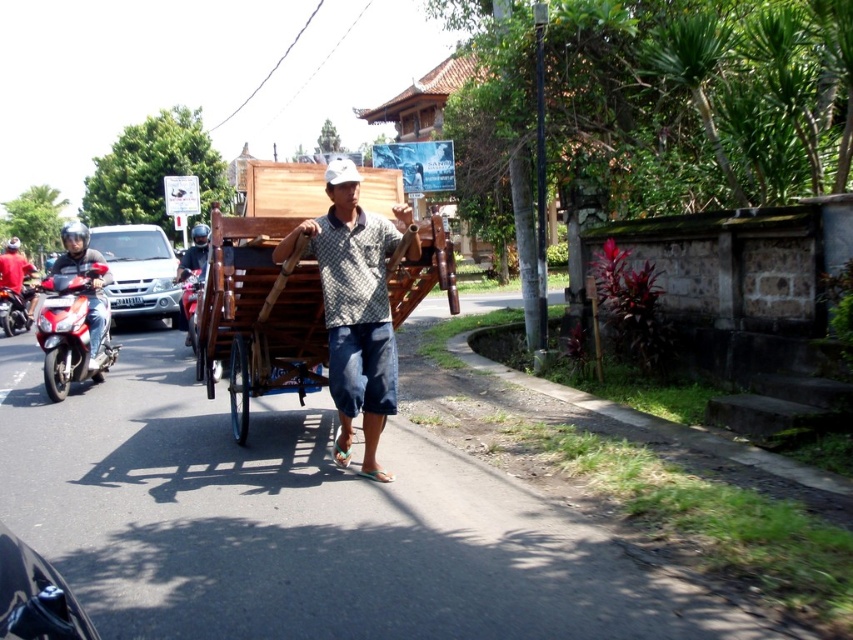
Is printed cotton shirt at center above matte black helmet at left?

Incorrect, printed cotton shirt at center is not positioned above matte black helmet at left.

Is printed cotton shirt at center further to the viewer compared to matte black helmet at left?

No, it is not.

Is point (373, 298) more distant than point (201, 228)?

That is False.

You are a GUI agent. You are given a task and a screenshot of the screen. Output one action in this format:
    pyautogui.click(x=<x>, y=<y>)
    Task: Click on the printed cotton shirt at center
    Image resolution: width=853 pixels, height=640 pixels.
    Given the screenshot: What is the action you would take?
    pyautogui.click(x=357, y=307)

Does silver metallic car at left have a smaller size compared to matte black motorcycle at left?

No.

Is silver metallic car at left taller than matte black motorcycle at left?

Correct, silver metallic car at left is much taller as matte black motorcycle at left.

Does point (113, 246) come in front of point (18, 248)?

Yes, it is in front of point (18, 248).

At what (x,y) coordinates should I click in order to perform the action: click on silver metallic car at left. Please return your answer as a coordinate pair (x, y). Looking at the image, I should click on (138, 269).

Measure the distance from silver metallic car at left to matte black helmet at left.

silver metallic car at left is 6.36 feet from matte black helmet at left.

Can you confirm if silver metallic car at left is thinner than matte black helmet at left?

Correct, silver metallic car at left's width is less than matte black helmet at left's.

Is point (111, 288) positioned after point (202, 248)?

Yes, it is behind point (202, 248).

Where is `silver metallic car at left`? silver metallic car at left is located at coordinates (138, 269).